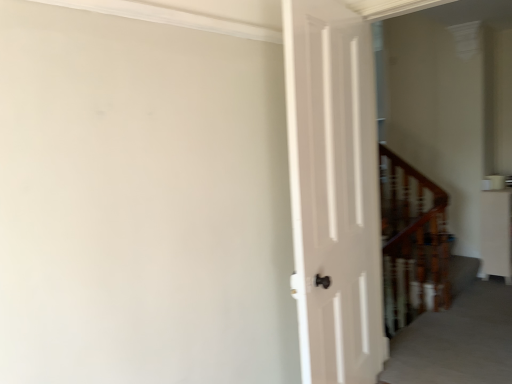
Question: Should I look upward or downward to see white glossy cabinet at right?

Choices:
 (A) down
 (B) up

Answer: (A)

Question: Is white glossy cabinet at right to the left of wooden staircase at right from the viewer's perspective?

Choices:
 (A) yes
 (B) no

Answer: (B)

Question: Would you say white glossy cabinet at right contains wooden staircase at right?

Choices:
 (A) no
 (B) yes

Answer: (A)

Question: Does white glossy cabinet at right have a lesser height compared to wooden staircase at right?

Choices:
 (A) no
 (B) yes

Answer: (B)

Question: Does white glossy cabinet at right have a greater width compared to wooden staircase at right?

Choices:
 (A) yes
 (B) no

Answer: (B)

Question: Is white glossy cabinet at right not close to wooden staircase at right?

Choices:
 (A) yes
 (B) no

Answer: (B)

Question: Are white glossy cabinet at right and wooden staircase at right beside each other?

Choices:
 (A) no
 (B) yes

Answer: (A)

Question: Can you confirm if wooden staircase at right is thinner than white glossy cabinet at right?

Choices:
 (A) yes
 (B) no

Answer: (B)

Question: Is wooden staircase at right closer to camera compared to white glossy cabinet at right?

Choices:
 (A) no
 (B) yes

Answer: (B)

Question: Is wooden staircase at right outside of white glossy cabinet at right?

Choices:
 (A) yes
 (B) no

Answer: (A)

Question: Is white glossy cabinet at right surrounded by wooden staircase at right?

Choices:
 (A) no
 (B) yes

Answer: (A)

Question: From a real-world perspective, is wooden staircase at right under white glossy cabinet at right?

Choices:
 (A) no
 (B) yes

Answer: (A)

Question: Is wooden staircase at right next to white glossy cabinet at right and touching it?

Choices:
 (A) no
 (B) yes

Answer: (A)

Question: From a real-world perspective, relative to wooden staircase at right, is white glossy cabinet at right vertically above or below?

Choices:
 (A) below
 (B) above

Answer: (A)